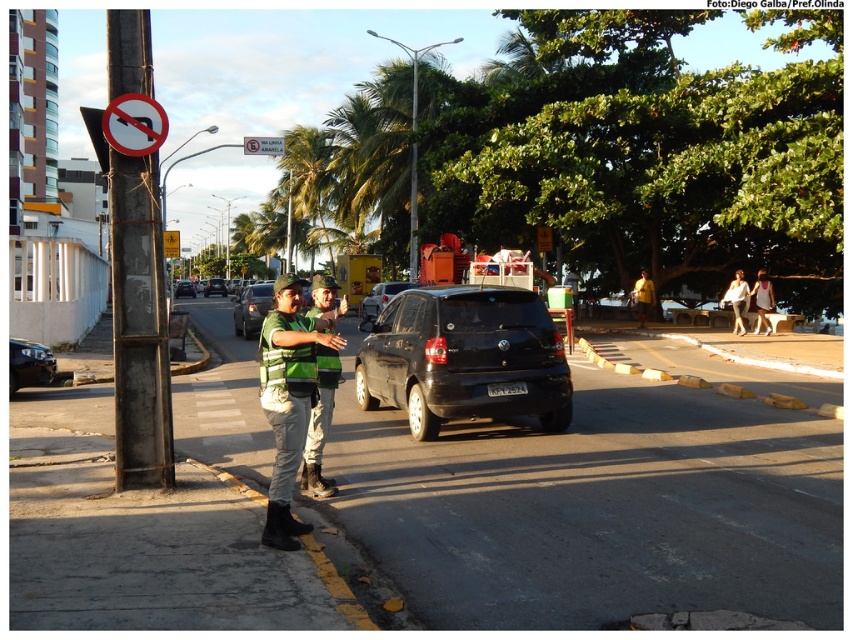
Which is below, black matte suv at center or shiny black sedan at lower left?

Positioned lower is shiny black sedan at lower left.

This screenshot has height=640, width=853. In order to click on black matte suv at center in this screenshot , I will do `click(463, 358)`.

Locate an element on the screen. Image resolution: width=853 pixels, height=640 pixels. rusty metal pole at left is located at coordinates (138, 326).

The height and width of the screenshot is (640, 853). What are the coordinates of `rusty metal pole at left` in the screenshot? It's located at (138, 326).

Is point (265, 300) positioned after point (759, 330)?

Yes, it is.

Who is lower down, shiny black sedan at center or white fabric dress at lower right?

Positioned lower is white fabric dress at lower right.

What do you see at coordinates (251, 308) in the screenshot? The image size is (853, 640). I see `shiny black sedan at center` at bounding box center [251, 308].

Locate an element on the screen. Image resolution: width=853 pixels, height=640 pixels. shiny black sedan at center is located at coordinates (251, 308).